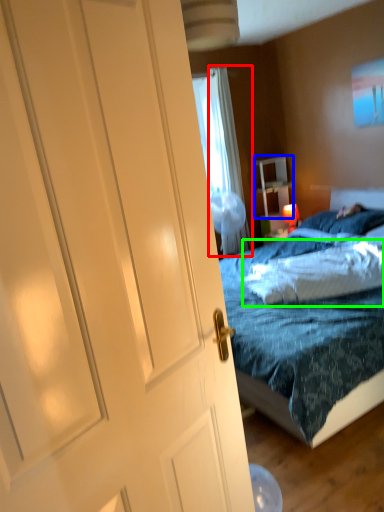
Question: Estimate the real-world distances between objects in this image. Which object is closer to curtain (highlighted by a red box), nightstand (highlighted by a blue box) or pillow (highlighted by a green box)?

Choices:
 (A) nightstand
 (B) pillow

Answer: (A)